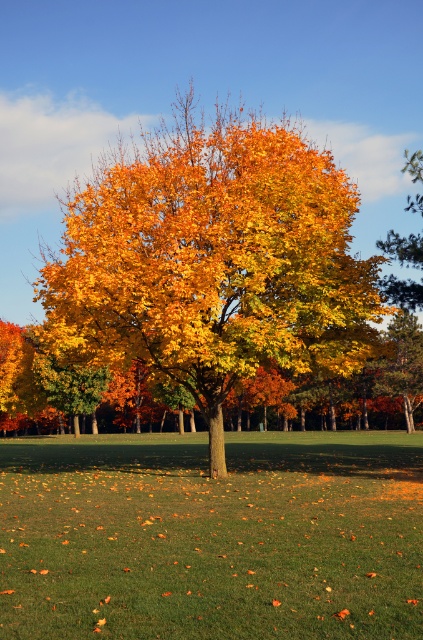
The height and width of the screenshot is (640, 423). Describe the element at coordinates (211, 536) in the screenshot. I see `green grass at center` at that location.

Is green grass at center above golden yellow leaves at upper right?

No.

Is point (162, 480) positioned behind point (381, 243)?

No, it is not.

Image resolution: width=423 pixels, height=640 pixels. Identify the location of green grass at center. (211, 536).

Which is more to the right, golden leafy tree at center or golden yellow leaves at upper right?

golden yellow leaves at upper right

Between point (233, 324) and point (406, 236), which one is positioned in front?

Positioned in front is point (233, 324).

Between point (272, 312) and point (419, 236), which one is positioned in front?

Point (272, 312) is more forward.

Find the location of a particular element. The height and width of the screenshot is (640, 423). golden leafy tree at center is located at coordinates (213, 262).

Which is more to the left, green grass at center or golden leafy tree at center?

golden leafy tree at center

How much distance is there between green grass at center and golden leafy tree at center?

A distance of 27.83 meters exists between green grass at center and golden leafy tree at center.

This screenshot has height=640, width=423. I want to click on green grass at center, so click(211, 536).

Image resolution: width=423 pixels, height=640 pixels. What are the coordinates of `green grass at center` in the screenshot? It's located at (211, 536).